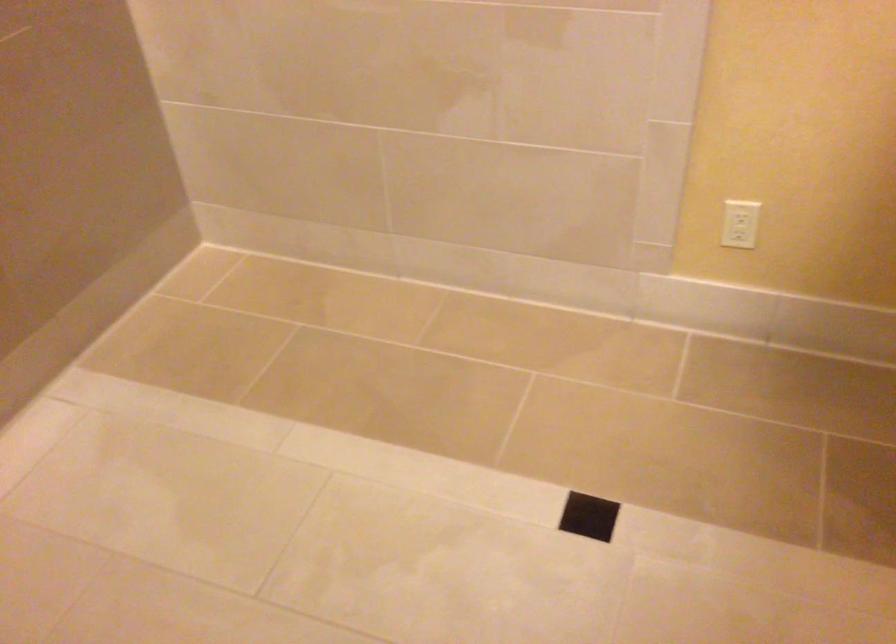
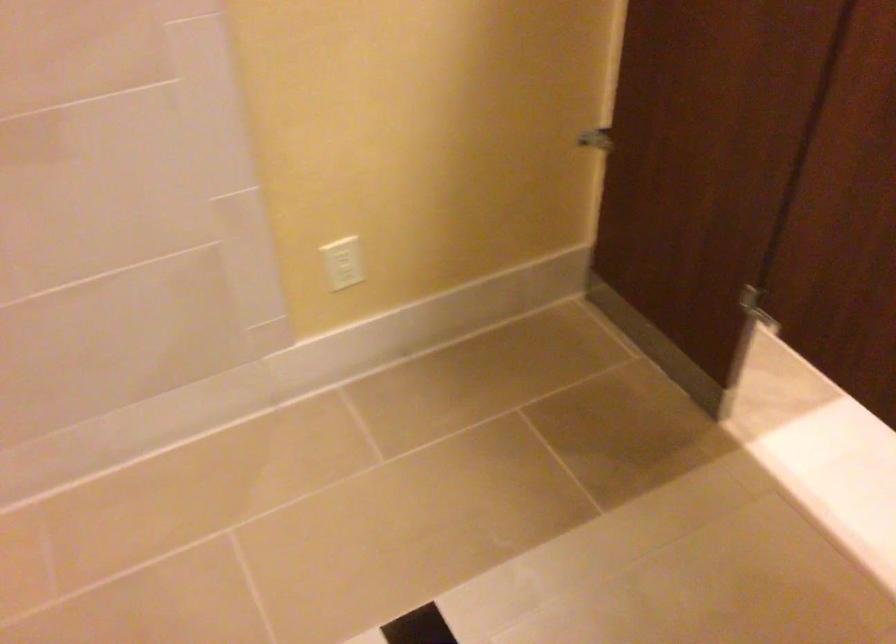
Question: The camera is either moving clockwise (left) or counter-clockwise (right) around the object. The first image is from the beginning of the video and the second image is from the end. Is the camera moving left or right when shooting the video?

Choices:
 (A) Left
 (B) Right

Answer: (A)